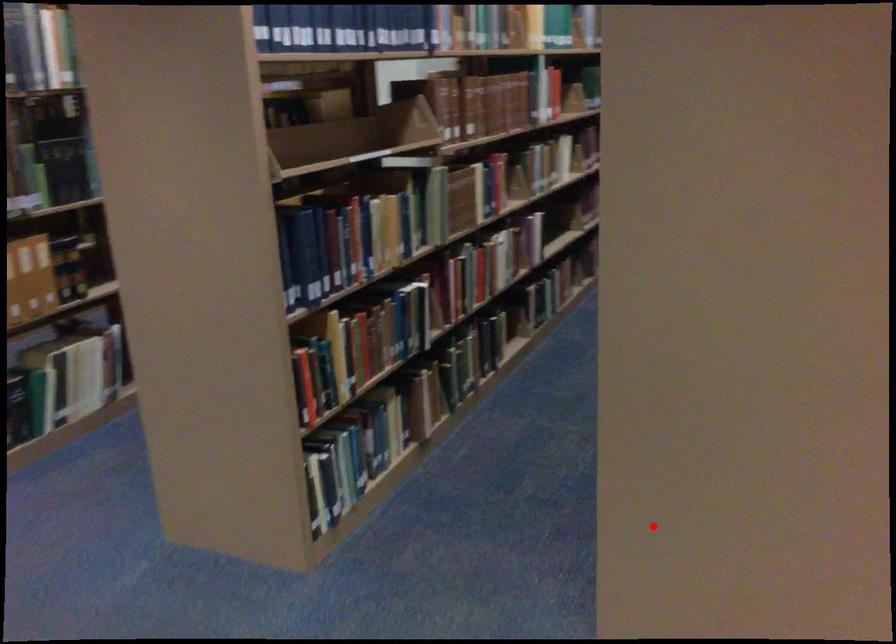
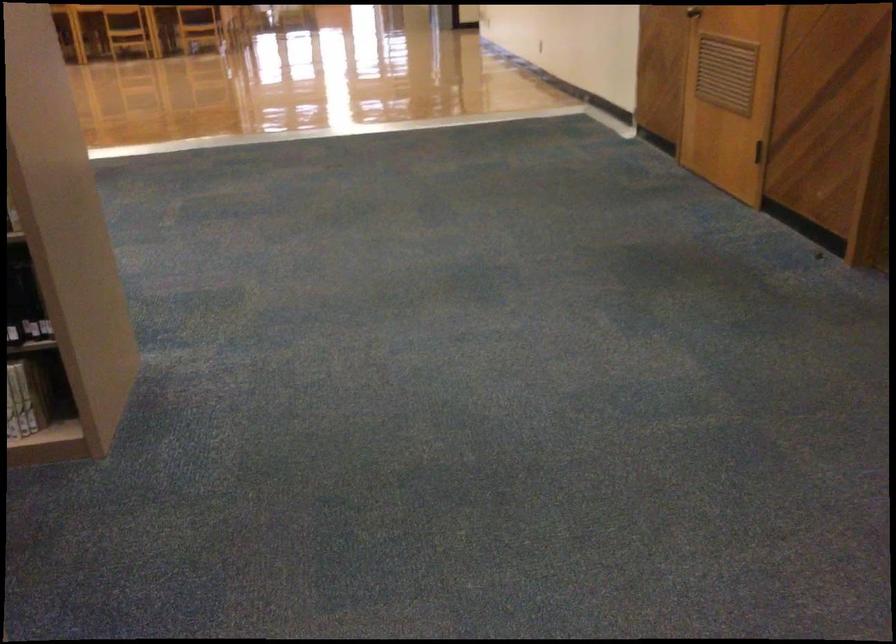
Question: I am providing you with two images of the same scene from different viewpoints. Given a red point in image1, look at the same physical point in image2. Is it:

Choices:
 (A) Closer to the viewpoint
 (B) Farther from the viewpoint

Answer: (B)